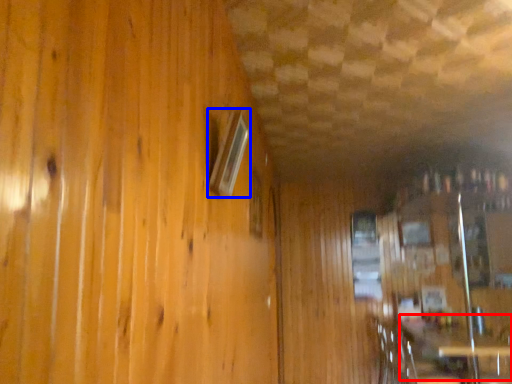
Question: Which point is further to the camera, table (highlighted by a red box) or window (highlighted by a blue box)?

Choices:
 (A) table
 (B) window

Answer: (A)